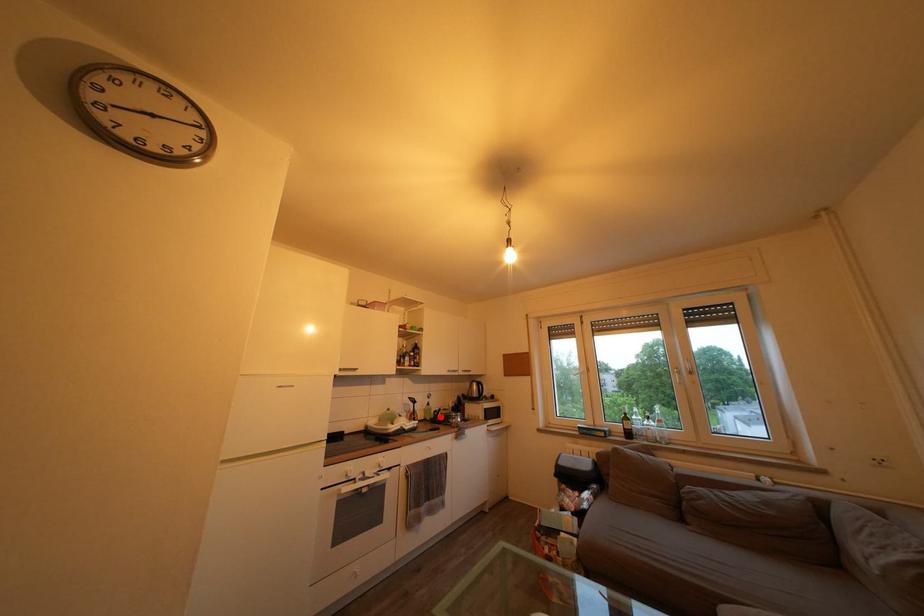
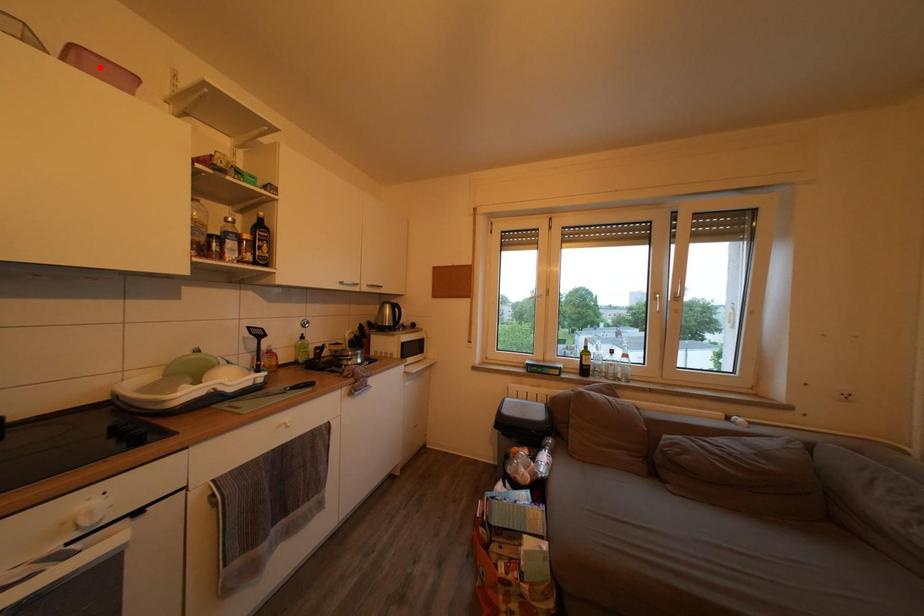
I am providing you with two images of the same scene from different viewpoints. A red point is marked on the first image and another point is marked on the second image. Is the marked point in image1 the same physical position as the marked point in image2?

No